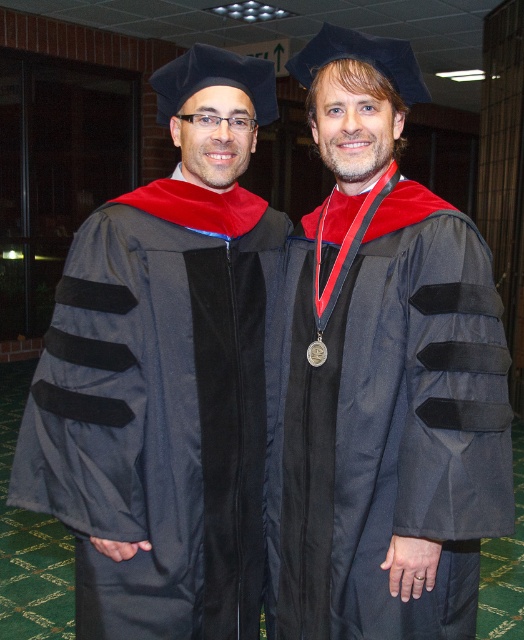
Is matte black graduation gown at center positioned in front of velvet black graduation gown at left?

Yes, matte black graduation gown at center is closer to the viewer.

Does point (387, 205) come closer to viewer compared to point (107, 410)?

No, it is behind (107, 410).

Between point (301, 570) and point (118, 497), which one is positioned behind?

Point (301, 570)

Identify the location of matte black graduation gown at center. The width and height of the screenshot is (524, 640). (383, 378).